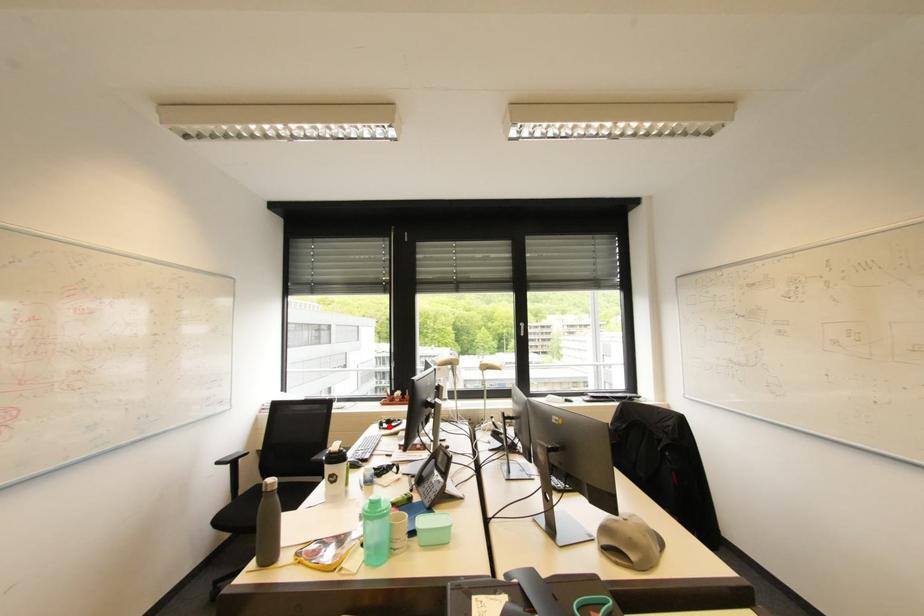
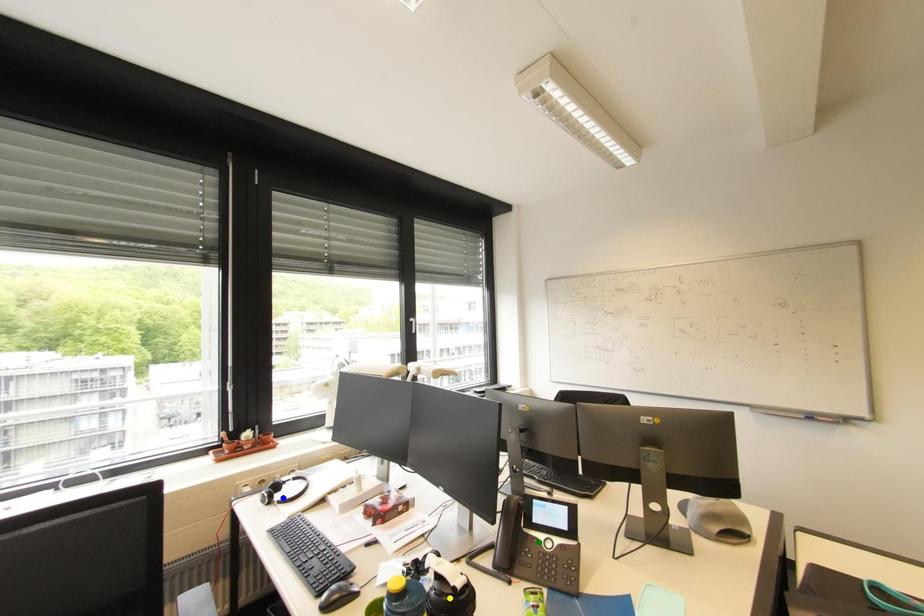
Question: I am providing you with two images of the same scene from different viewpoints. A red point is marked on the first image. You are given multiple points on the second image. Which point in image 2 is actually the same real-world point as the red point in image 1?

Choices:
 (A) green point
 (B) blue point
 (C) yellow point

Answer: (B)